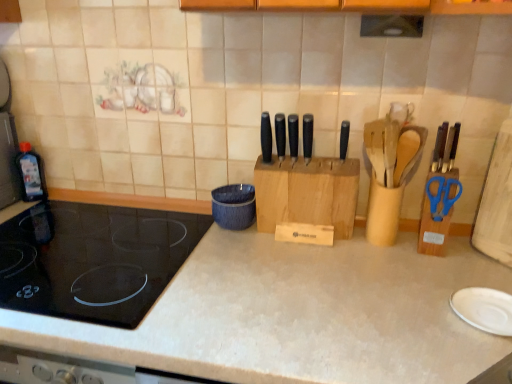
Locate an element on the screen. Image resolution: width=512 pixels, height=384 pixels. vacant area situated to the left side of blue textured bowl at center is located at coordinates (172, 228).